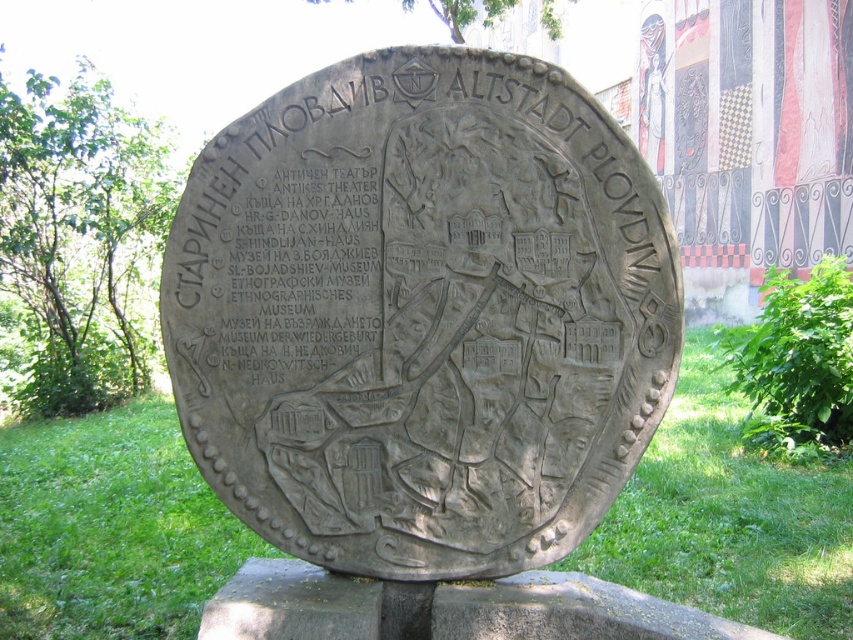
You are a tour guide explaining the historical marker to visitors. You want to mention the size comparison between the gray stone plaque at center and the green grass at lower center. How would you describe their widths?

The gray stone plaque at center is wider than the green grass at lower center, as its width surpasses that of the grass area.

You are standing at the circular stone plaque and want to locate two specific points marked on it. The first point is at coordinates point (573, 436) and the second point is at point (761, 480). From your vantage point, which point appears closer to you?

Point (573, 436) is in front of point (761, 480), so it appears closer to you.